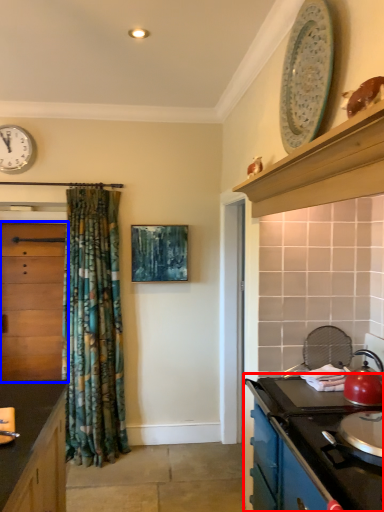
Question: Which point is closer to the camera, cabinetry (highlighted by a red box) or cabinetry (highlighted by a blue box)?

Choices:
 (A) cabinetry
 (B) cabinetry

Answer: (A)